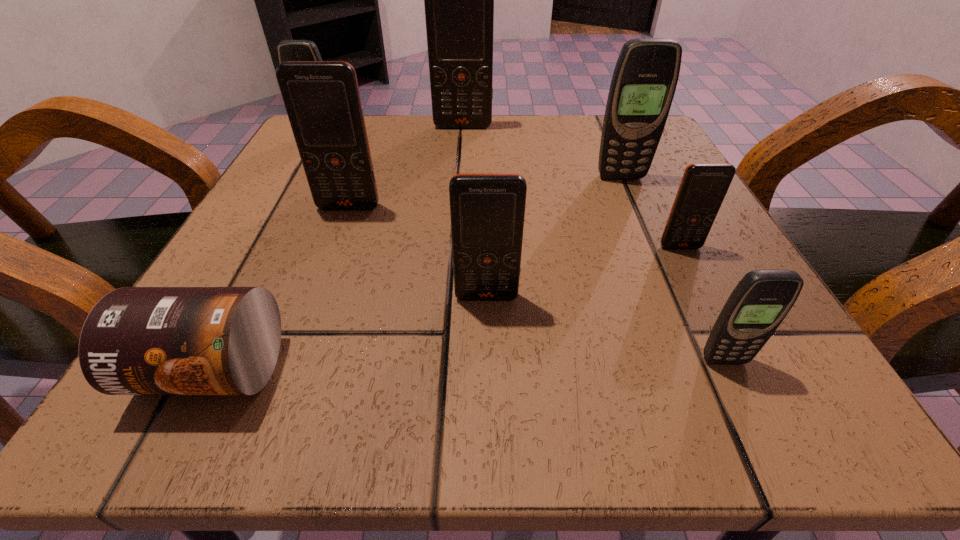
Locate an element on the screen. This screenshot has width=960, height=540. free space between the shortest object and the rightmost orange cellular telephone is located at coordinates (446, 308).

This screenshot has height=540, width=960. Find the location of `free spot between the biggest orange cellular telephone and the second farthest gray cellular telephone`. free spot between the biggest orange cellular telephone and the second farthest gray cellular telephone is located at coordinates (541, 152).

The width and height of the screenshot is (960, 540). Identify the location of empty space between the tallest cellular telephone and the shortest object. (338, 248).

I want to click on vacant space in between the nearest cellular telephone and the second smallest orange cellular telephone, so [x=606, y=328].

Point out which object is positioned as the third nearest to the farthest cellular telephone. Please provide its 2D coordinates. Your answer should be formatted as a tuple, i.e. [(x, y)], where the tuple contains the x and y coordinates of a point satisfying the conditions above.

[(322, 99)]

Where is `object identified as the third closest to the second smallest orange cellular telephone`? Image resolution: width=960 pixels, height=540 pixels. object identified as the third closest to the second smallest orange cellular telephone is located at coordinates (322, 99).

You are a GUI agent. You are given a task and a screenshot of the screen. Output one action in this format:
    pyautogui.click(x=<x>, y=<y>)
    Task: Click on the sixth closest cellular telephone to the second farthest object
    This screenshot has width=960, height=540.
    Given the screenshot: What is the action you would take?
    pyautogui.click(x=759, y=303)

At what (x,y) coordinates should I click in order to perform the action: click on cellular telephone that is the fourth closest to the sixth farthest cellular telephone. Please return your answer as a coordinate pair (x, y). The image size is (960, 540). Looking at the image, I should click on (645, 77).

Point out which orange cellular telephone is positioned as the nearest to the third farthest cellular telephone. Please provide its 2D coordinates. Your answer should be formatted as a tuple, i.e. [(x, y)], where the tuple contains the x and y coordinates of a point satisfying the conditions above.

[(703, 187)]

At what (x,y) coordinates should I click in order to perform the action: click on orange cellular telephone that stands as the third closest to the fourth farthest cellular telephone. Please return your answer as a coordinate pair (x, y). Looking at the image, I should click on (703, 187).